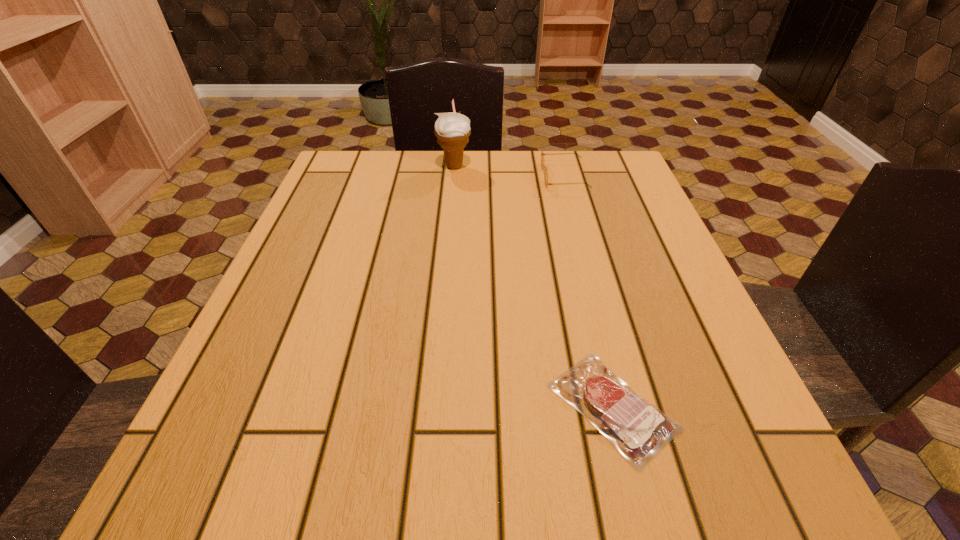
The height and width of the screenshot is (540, 960). Find the location of `vacant space that's between the steak and the second shortest object`. vacant space that's between the steak and the second shortest object is located at coordinates (588, 291).

Identify the location of free point between the nearest object and the leftmost object. (534, 286).

You are a GUI agent. You are given a task and a screenshot of the screen. Output one action in this format:
    pyautogui.click(x=<x>, y=<y>)
    Task: Click on the object that is the second closest to the shortest object
    
    Given the screenshot: What is the action you would take?
    pyautogui.click(x=453, y=130)

You are a GUI agent. You are given a task and a screenshot of the screen. Output one action in this format:
    pyautogui.click(x=<x>, y=<y>)
    Task: Click on the object that stands as the second closest to the steak
    
    Given the screenshot: What is the action you would take?
    pos(453,130)

At what (x,y) coordinates should I click in order to perform the action: click on vacant space that satisfies the following two spatial constraints: 1. on the face of the second tallest object; 2. on the front side of the steak. Please return your answer as a coordinate pair (x, y). The height and width of the screenshot is (540, 960). Looking at the image, I should click on (627, 406).

In order to click on vacant space that satisfies the following two spatial constraints: 1. on the front side of the leftmost object; 2. on the left side of the steak in this screenshot , I will do `click(434, 406)`.

Locate an element on the screen. The height and width of the screenshot is (540, 960). vacant space that satisfies the following two spatial constraints: 1. on the front side of the tallest object; 2. on the left side of the steak is located at coordinates (434, 406).

Where is `free spot that satisfies the following two spatial constraints: 1. on the front side of the shortest object; 2. on the left side of the leftmost object`? free spot that satisfies the following two spatial constraints: 1. on the front side of the shortest object; 2. on the left side of the leftmost object is located at coordinates (434, 406).